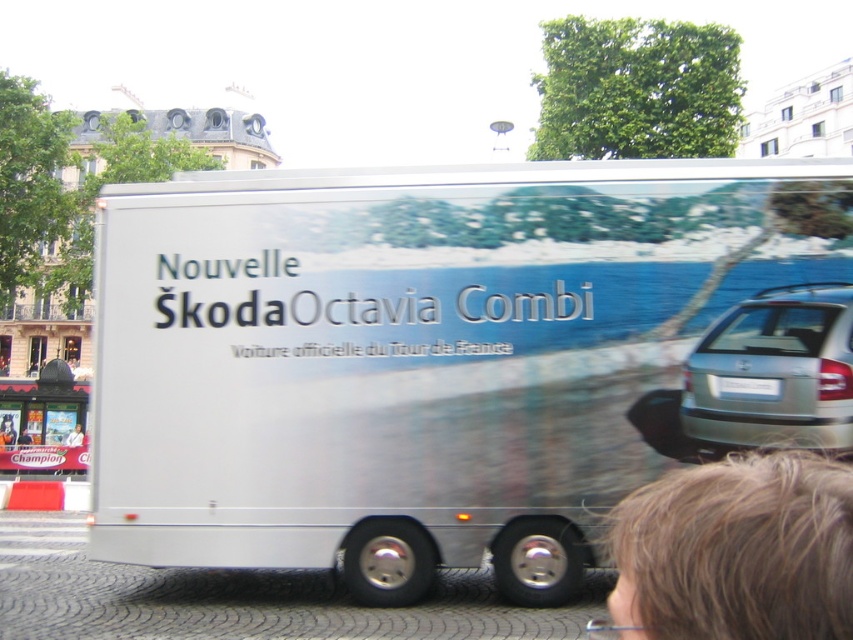
You are a delivery person trying to park a truck that is 2.5 meters wide. You see the white matte bus at lower left and the smooth black hair at lower right in the image. Can your truck fit between them if they are parked side by side?

The white matte bus at lower left might be wider than smooth black hair at lower right. Since the truck is 2.5 meters wide, it is uncertain if there is enough space between them. Check the actual width before attempting to park.

You are a pedestrian standing on the cobblestone street in front of the trailer. You notice the white matte bus at lower left and the smooth black hair at lower right. Which object is positioned higher relative to the other?

The white matte bus at lower left is positioned above smooth black hair at lower right.

You are standing on the cobblestone street in front of the white metallic truck at center. If you walk directly towards the truck, will you first reach the truck or the buildings behind it?

The white metallic truck at center is located at point (x=416, y=355), so you will first reach the truck before the buildings behind it.